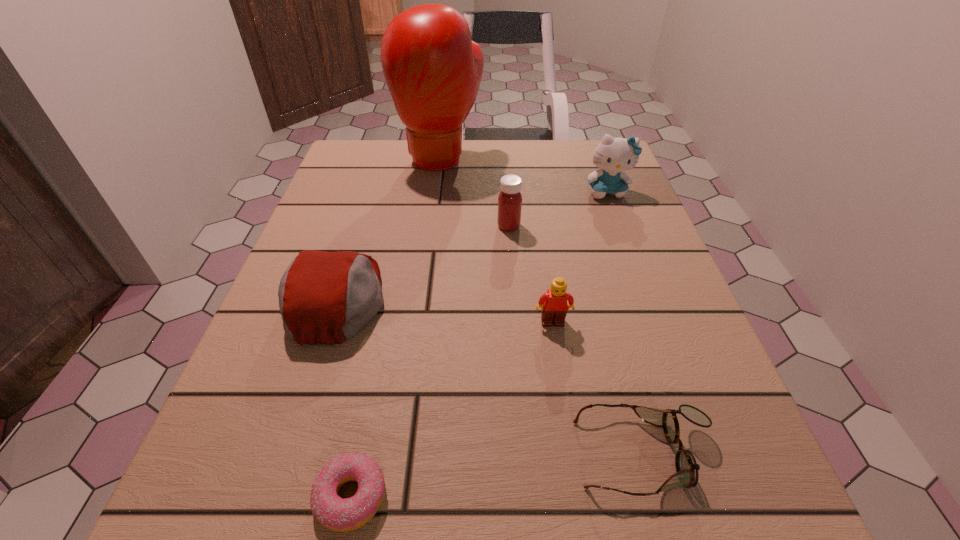
Find the location of a particular element. The image size is (960, 540). kitten that is at the far edge is located at coordinates [x=613, y=155].

Where is `spectacles present at the near edge`? The image size is (960, 540). spectacles present at the near edge is located at coordinates (687, 469).

I want to click on doughnut that is positioned at the near edge, so click(x=337, y=514).

You are a GUI agent. You are given a task and a screenshot of the screen. Output one action in this format:
    pyautogui.click(x=<x>, y=<y>)
    Task: Click on the boxing glove situated at the left edge
    The image size is (960, 540).
    Given the screenshot: What is the action you would take?
    [433, 69]

This screenshot has width=960, height=540. I want to click on cap that is at the left edge, so pyautogui.click(x=325, y=297).

Find the location of a particular element. doughnut that is at the left edge is located at coordinates (337, 514).

Identify the location of kitten at the right edge. (613, 155).

Find the location of a particular element. The height and width of the screenshot is (540, 960). spectacles that is at the right edge is located at coordinates (687, 469).

Where is `object present at the far left corner`? Image resolution: width=960 pixels, height=540 pixels. object present at the far left corner is located at coordinates (433, 69).

You are a GUI agent. You are given a task and a screenshot of the screen. Output one action in this format:
    pyautogui.click(x=<x>, y=<y>)
    Task: Click on the object present at the near left corner
    The height and width of the screenshot is (540, 960).
    Given the screenshot: What is the action you would take?
    pyautogui.click(x=337, y=514)